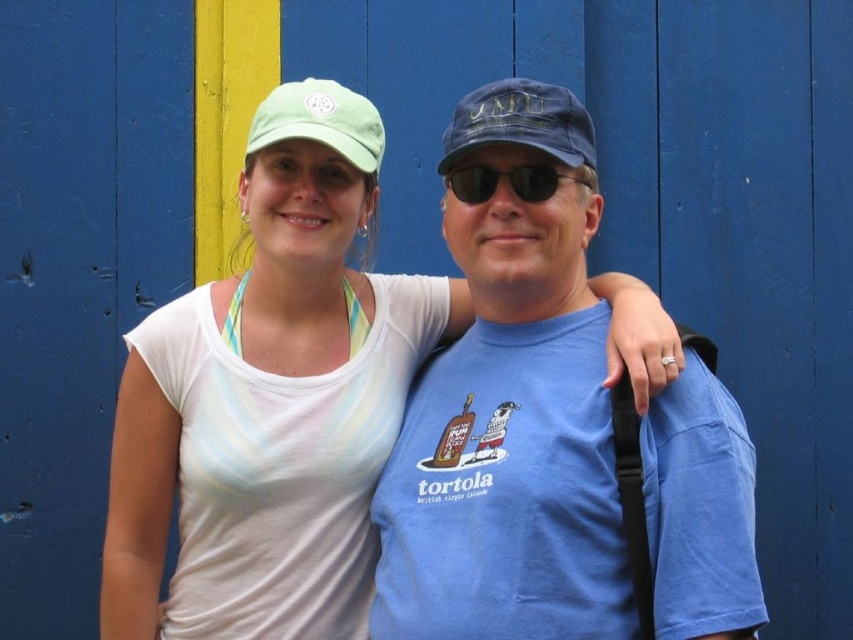
Between blue denim baseball cap at center and green fabric baseball cap at upper center, which one is positioned lower?

Positioned lower is blue denim baseball cap at center.

The width and height of the screenshot is (853, 640). What are the coordinates of `blue denim baseball cap at center` in the screenshot? It's located at (520, 122).

Locate an element on the screen. The height and width of the screenshot is (640, 853). blue denim baseball cap at center is located at coordinates (520, 122).

Is the position of blue cotton t-shirt at center less distant than that of blue denim baseball cap at center?

Yes, blue cotton t-shirt at center is closer to the viewer.

Between blue cotton t-shirt at center and blue denim baseball cap at center, which one is positioned higher?

blue denim baseball cap at center is higher up.

The image size is (853, 640). Find the location of `blue cotton t-shirt at center`. blue cotton t-shirt at center is located at coordinates (509, 410).

What are the coordinates of `blue cotton t-shirt at center` in the screenshot? It's located at (509, 410).

Is point (151, 435) farther from viewer compared to point (579, 179)?

Yes, point (151, 435) is behind point (579, 179).

Is white fabric tank top at center smaller than sunglasses at center?

No.

This screenshot has width=853, height=640. What do you see at coordinates (297, 262) in the screenshot?
I see `white fabric tank top at center` at bounding box center [297, 262].

You are a GUI agent. You are given a task and a screenshot of the screen. Output one action in this format:
    pyautogui.click(x=<x>, y=<y>)
    Task: Click on the white fabric tank top at center
    This screenshot has width=853, height=640.
    Given the screenshot: What is the action you would take?
    pyautogui.click(x=297, y=262)